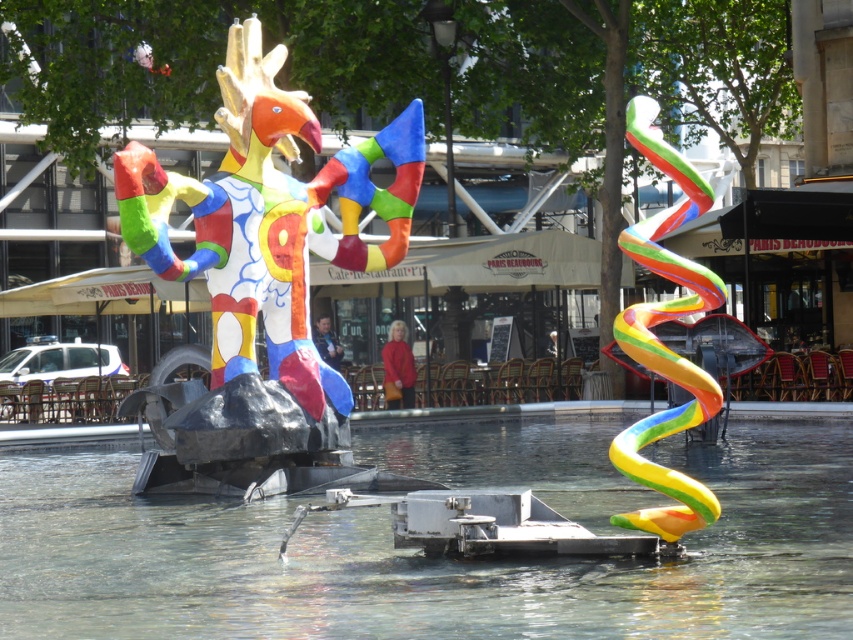
You are a visitor at the plaza and want to take a photo of the clear glass water at center and the multicolored painted sculpture at center. Which object should you focus on first if you want to capture both in one frame without moving the camera?

You should focus on the multicolored painted sculpture at center first because it is taller than the clear glass water at center, so it will occupy more space in the frame.

You are standing in the plaza and want to touch both the clear glass water at center and the rainbow rubber spiral at right. Which object will you reach first?

The clear glass water at center is closer to the viewer than the rainbow rubber spiral at right, so you will reach the clear glass water at center first.